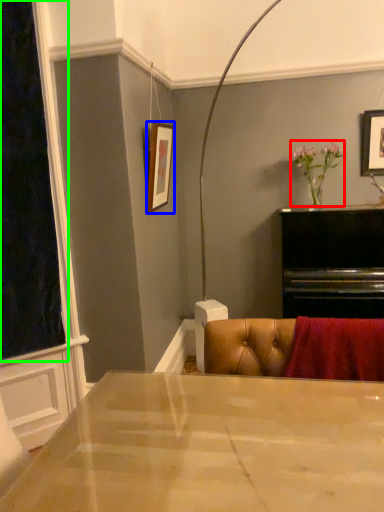
Question: Based on their relative distances, which object is farther from floral arrangement (highlighted by a red box)? Choose from picture frame (highlighted by a blue box) and window screen (highlighted by a green box).

Choices:
 (A) picture frame
 (B) window screen

Answer: (B)